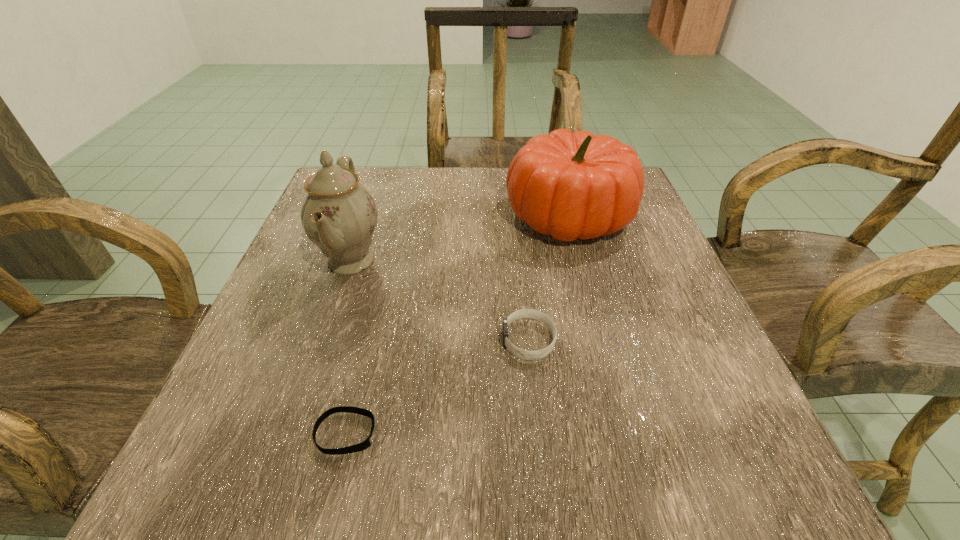
Identify the location of free space between the third farthest object and the chinaware. The width and height of the screenshot is (960, 540). (440, 300).

Locate an element on the screen. Image resolution: width=960 pixels, height=540 pixels. blank region between the nearest object and the second tallest object is located at coordinates (458, 325).

This screenshot has width=960, height=540. In order to click on blank region between the chinaware and the third shortest object in this screenshot , I will do [460, 239].

Where is `unoccupied position between the farther wristband and the chinaware`? The height and width of the screenshot is (540, 960). unoccupied position between the farther wristband and the chinaware is located at coordinates (440, 300).

Identify which object is the third closest to the pumpkin. Please provide its 2D coordinates. Your answer should be formatted as a tuple, i.e. [(x, y)], where the tuple contains the x and y coordinates of a point satisfying the conditions above.

[(365, 444)]

Locate which object ranks third in proximity to the third shortest object. Please provide its 2D coordinates. Your answer should be formatted as a tuple, i.e. [(x, y)], where the tuple contains the x and y coordinates of a point satisfying the conditions above.

[(365, 444)]